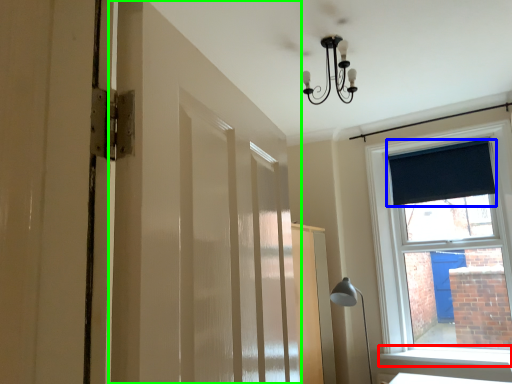
Question: Which object is the farthest from window sill (highlighted by a red box)? Choose among these: curtain (highlighted by a blue box) or barn door (highlighted by a green box).

Choices:
 (A) curtain
 (B) barn door

Answer: (B)